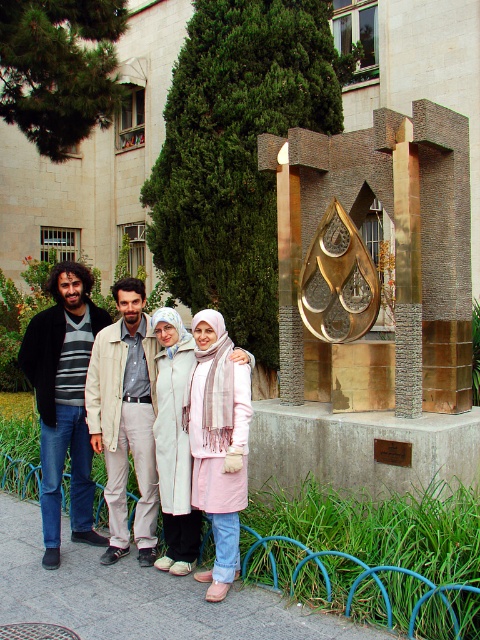
You are a photographer adjusting your camera settings to capture the group photo. You notice the gold metallic sculpture at center and the dark blue jeans at left in your frame. Which object is positioned higher in the image?

The gold metallic sculpture at center is located above the dark blue jeans at left, so it is positioned higher in the image.

You are a photographer adjusting the camera settings. You need to ensure that both the dark blue jeans at left and the tan fabric jacket at center are in focus. Which object should you adjust the focus for first to account for their sizes?

The dark blue jeans at left might be wider than tan fabric jacket at center, so you should adjust the focus for the dark blue jeans at left first to ensure proper focus given their larger size.

You are a photographer trying to capture a group photo of the gold metallic sculpture at center and the dark blue jeans at left. Which object should you focus on first if you want to ensure both are in frame and properly sized?

The gold metallic sculpture at center is bigger than the dark blue jeans at left. To ensure both are in frame and properly sized, focus on the gold metallic sculpture at center first as it requires more space due to its larger size.